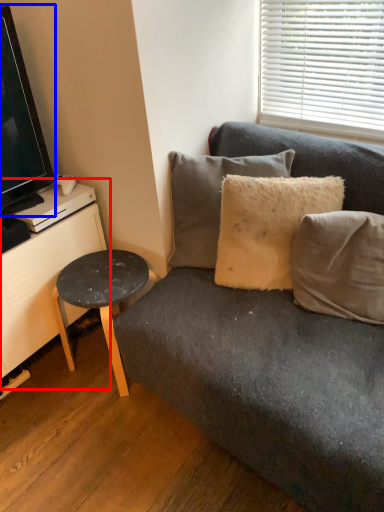
Question: Which point is further to the camera, dresser (highlighted by a red box) or television (highlighted by a blue box)?

Choices:
 (A) dresser
 (B) television

Answer: (A)